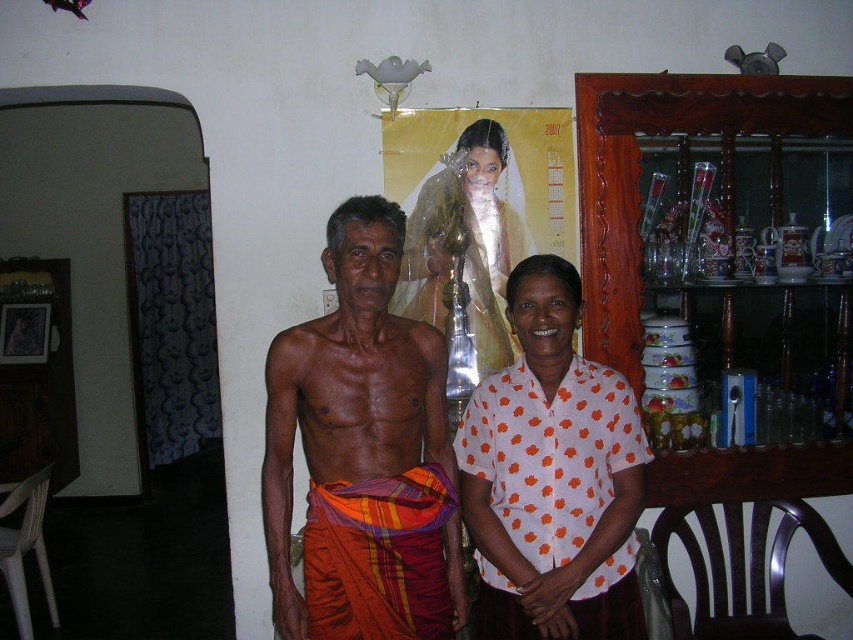
Does orange woven cloth at center have a smaller size compared to white satin dress at center?

No, orange woven cloth at center is not smaller than white satin dress at center.

Is point (366, 444) more distant than point (479, 250)?

No, it is not.

Is point (401, 396) farther from viewer compared to point (473, 276)?

No.

Locate an element on the screen. orange woven cloth at center is located at coordinates (363, 452).

You are a GUI agent. You are given a task and a screenshot of the screen. Output one action in this format:
    pyautogui.click(x=<x>, y=<y>)
    Task: Click on the orange woven cloth at center
    This screenshot has height=640, width=853.
    Given the screenshot: What is the action you would take?
    pyautogui.click(x=363, y=452)

Between orange woven cloth at center and white dotted shirt at center, which one appears on the left side from the viewer's perspective?

From the viewer's perspective, orange woven cloth at center appears more on the left side.

Which is behind, point (374, 220) or point (527, 561)?

Point (527, 561)

Locate an element on the screen. orange woven cloth at center is located at coordinates (363, 452).

Is white dotted shirt at center positioned at the back of white satin dress at center?

No, white dotted shirt at center is closer to the viewer.

Between white dotted shirt at center and white satin dress at center, which one has less height?

white dotted shirt at center

Does point (517, 572) come closer to viewer compared to point (419, 288)?

Yes, point (517, 572) is in front of point (419, 288).

The height and width of the screenshot is (640, 853). Find the location of `white dotted shirt at center`. white dotted shirt at center is located at coordinates (552, 476).